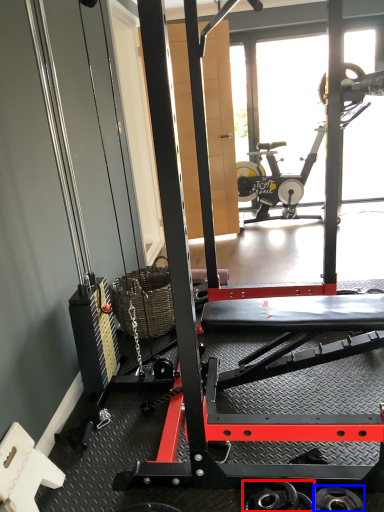
Question: Which point is further to the camera, wheel (highlighted by a red box) or wheel (highlighted by a blue box)?

Choices:
 (A) wheel
 (B) wheel

Answer: (B)